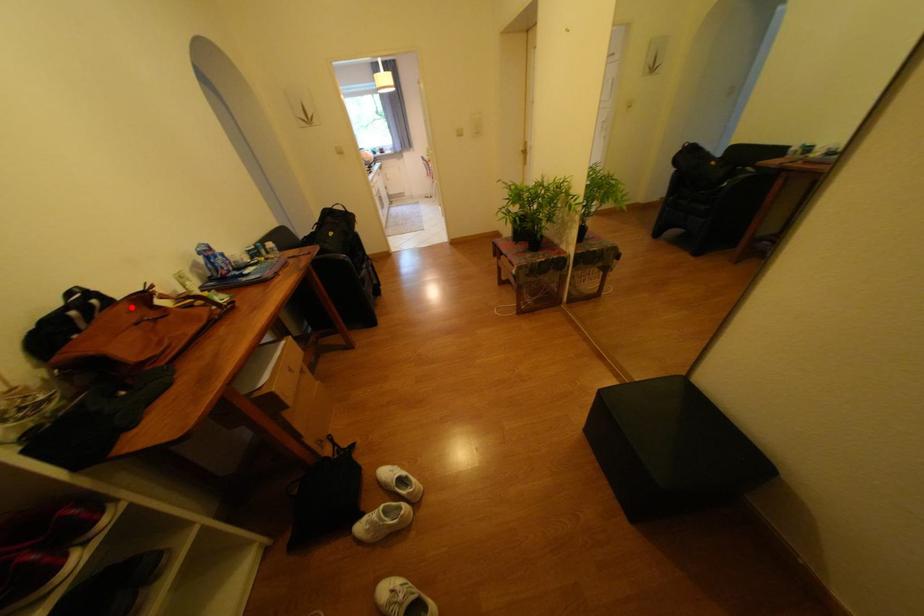
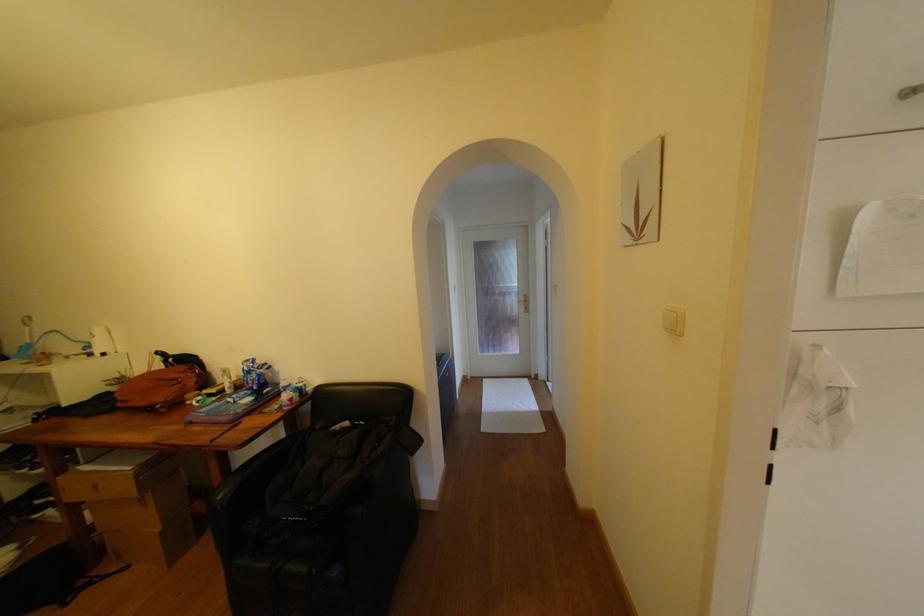
In the second image, find the point that corresponds to the highlighted location in the first image.

(190, 369)